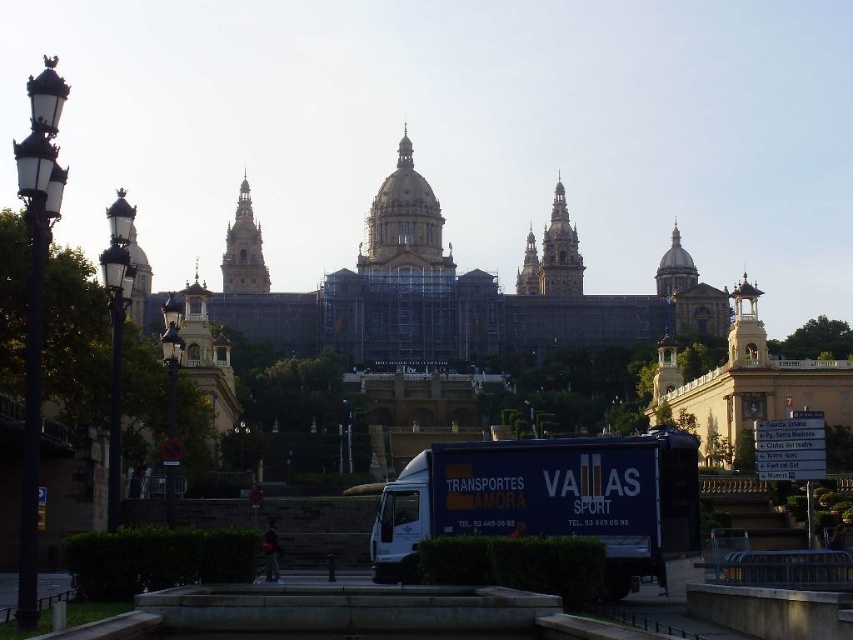
This screenshot has height=640, width=853. Describe the element at coordinates (450, 291) in the screenshot. I see `golden stone palace at center` at that location.

Between golden stone palace at center and blue matte truck at center, which one is positioned higher?

golden stone palace at center

Is point (415, 312) farther from viewer compared to point (561, 512)?

Yes.

The width and height of the screenshot is (853, 640). In order to click on golden stone palace at center in this screenshot , I will do `click(450, 291)`.